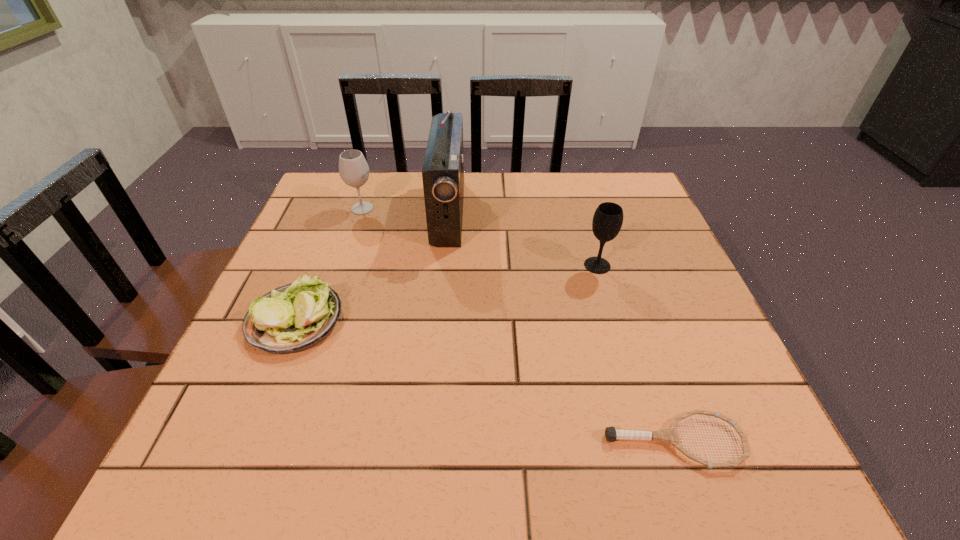
Find the location of a particular element. This screenshot has width=960, height=540. vacant space located 0.050m on the right of the farther wineglass is located at coordinates (395, 208).

Image resolution: width=960 pixels, height=540 pixels. What are the coordinates of `vacant region located on the left of the third nearest object` in the screenshot? It's located at (476, 266).

Locate an element on the screen. This screenshot has width=960, height=540. vacant space positioned on the back of the fourth farthest object is located at coordinates (343, 204).

At what (x,y) coordinates should I click in order to perform the action: click on vacant space situated on the back of the tennis racket. Please return your answer as a coordinate pair (x, y). The height and width of the screenshot is (540, 960). Looking at the image, I should click on (656, 388).

What are the coordinates of `radio receiver positioned at the far edge` in the screenshot? It's located at (443, 170).

Locate an element on the screen. wineglass located in the far edge section of the desktop is located at coordinates (353, 169).

Where is `object that is at the near edge`? object that is at the near edge is located at coordinates coord(669,435).

Find the location of `wineglass that is at the left edge`. wineglass that is at the left edge is located at coordinates (353, 169).

Identify the location of lettuce that is positioned at the left edge. (289, 319).

Find the location of a particular element. wineglass that is at the right edge is located at coordinates (607, 221).